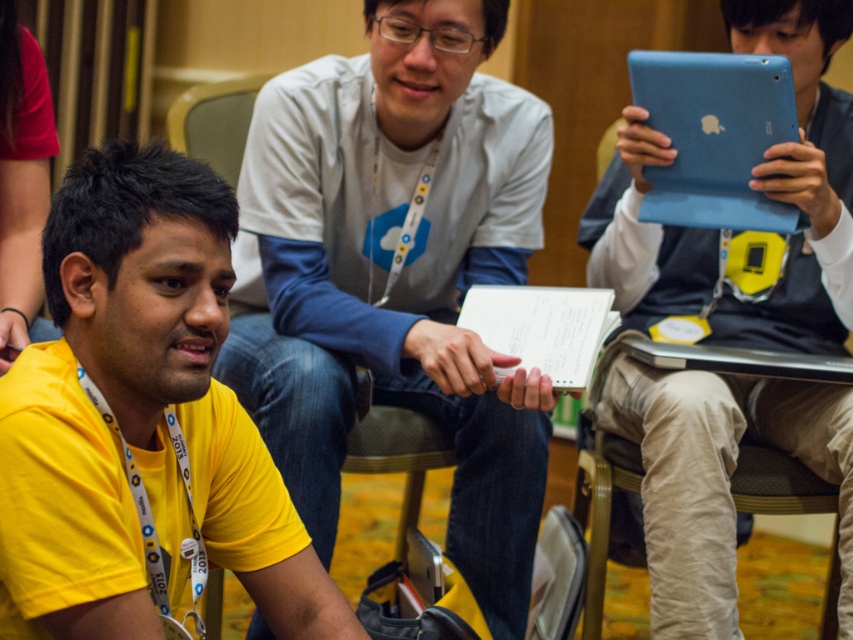
Can you confirm if yellow t-shirt at center is positioned to the right of blue matte tablet at upper right?

Incorrect, yellow t-shirt at center is not on the right side of blue matte tablet at upper right.

Measure the distance between yellow t-shirt at center and camera.

yellow t-shirt at center is 1.10 meters from camera.

Where is `yellow t-shirt at center`? The height and width of the screenshot is (640, 853). yellow t-shirt at center is located at coordinates (141, 413).

At what (x,y) coordinates should I click in order to perform the action: click on yellow t-shirt at center. Please return your answer as a coordinate pair (x, y). This screenshot has width=853, height=640. Looking at the image, I should click on (141, 413).

Is white matte shirt at center smaller than blue matte tablet at upper right?

No.

Can you confirm if white matte shirt at center is positioned to the left of blue matte tablet at upper right?

Indeed, white matte shirt at center is positioned on the left side of blue matte tablet at upper right.

Between point (384, 266) and point (674, 163), which one is positioned in front?

Point (674, 163) is more forward.

This screenshot has height=640, width=853. Find the location of `white matte shirt at center`. white matte shirt at center is located at coordinates (396, 275).

Does yellow t-shirt at center appear on the left side of blue matte tablet at center?

Indeed, yellow t-shirt at center is positioned on the left side of blue matte tablet at center.

Which is in front, point (83, 200) or point (688, 472)?

Point (83, 200) is in front.

Where is `yellow t-shirt at center`? yellow t-shirt at center is located at coordinates (141, 413).